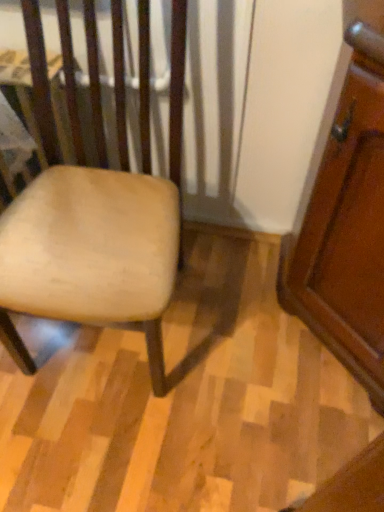
Question: Relative to light brown wood chair at left, is wooden screen door at right in front or behind?

Choices:
 (A) behind
 (B) front

Answer: (A)

Question: Is wooden screen door at right inside the boundaries of light brown wood chair at left, or outside?

Choices:
 (A) outside
 (B) inside

Answer: (A)

Question: Considering the positions of wooden screen door at right and light brown wood chair at left in the image, is wooden screen door at right wider or thinner than light brown wood chair at left?

Choices:
 (A) thin
 (B) wide

Answer: (A)

Question: Would you say light brown wood chair at left is inside or outside wooden screen door at right?

Choices:
 (A) outside
 (B) inside

Answer: (A)

Question: From the image's perspective, is light brown wood chair at left located above or below wooden screen door at right?

Choices:
 (A) below
 (B) above

Answer: (B)

Question: Is light brown wood chair at left in front of or behind wooden screen door at right in the image?

Choices:
 (A) front
 (B) behind

Answer: (A)

Question: Considering the relative positions of light brown wood chair at left and wooden screen door at right in the image provided, is light brown wood chair at left to the left or to the right of wooden screen door at right?

Choices:
 (A) left
 (B) right

Answer: (A)